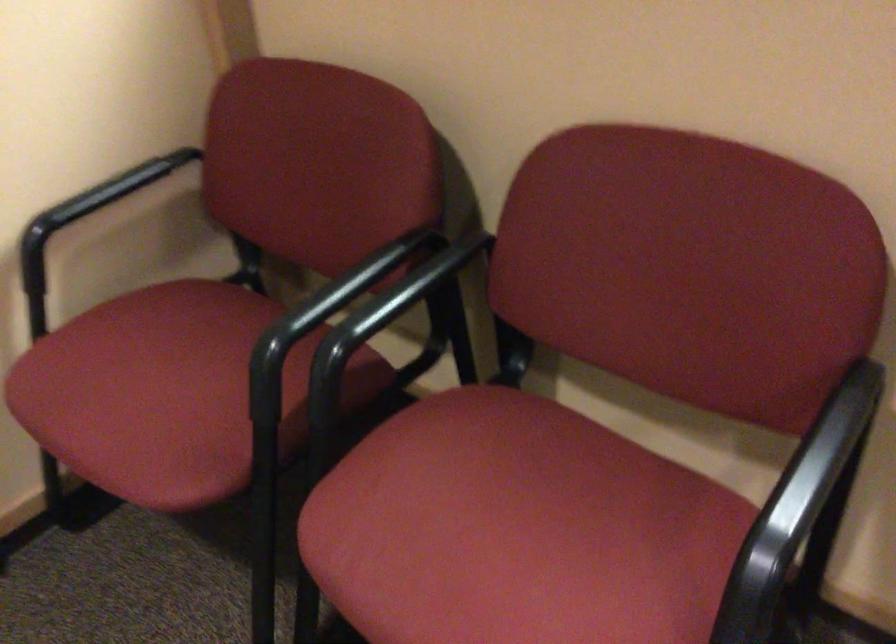
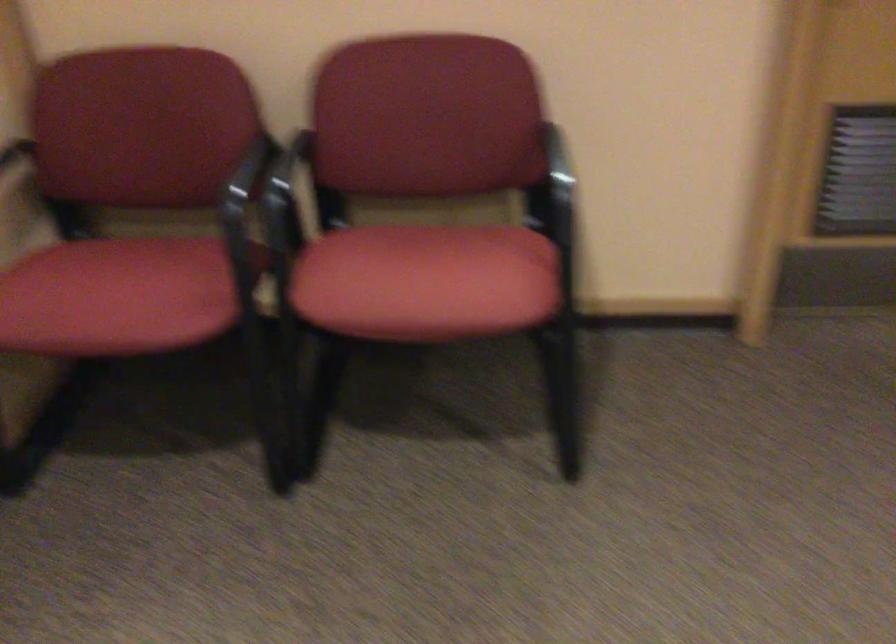
In the second image, find the point that corresponds to pixel 126 397 in the first image.

(116, 297)